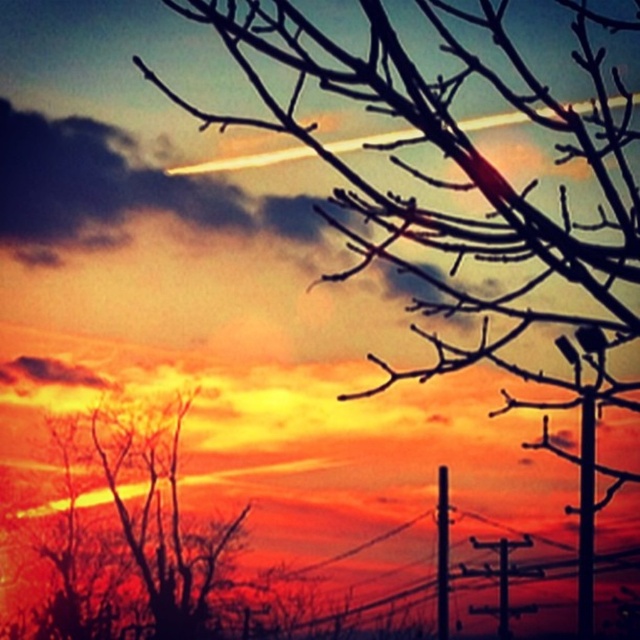
You are an artist trying to paint this sunset scene. You notice two poles in the image. Which pole is positioned higher in the sky between the smooth metallic pole at center right and the metallic gray telegraph pole at center?

The smooth metallic pole at center right is positioned higher in the sky than the metallic gray telegraph pole at center.

You are standing in front of the sunset scene and want to take a photo. The silhouette bare tree at left is represented by point (140, 540). Where should you position the tree in your camera frame to ensure it aligns with the golden ratio? Please provide coordinates based on a 1x1 grid system.

To align the silhouette bare tree at left with the golden ratio, position it at approximately 0.618 on the horizontal axis and 0.618 on the vertical axis within the 1x1 grid system.

You are standing in the field looking at the sunset scene. The silhouette bare tree at left is blocking your view of the airplane contrail. Can you move to the right to see the contrail better?

The silhouette bare tree at left is located at point (140, 540), so moving to the right might help you see the contrail better as the tree is positioned on the left side of the image.